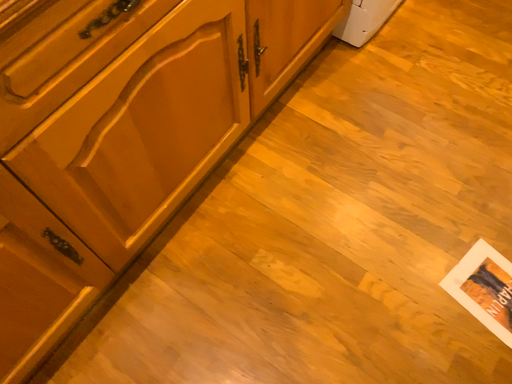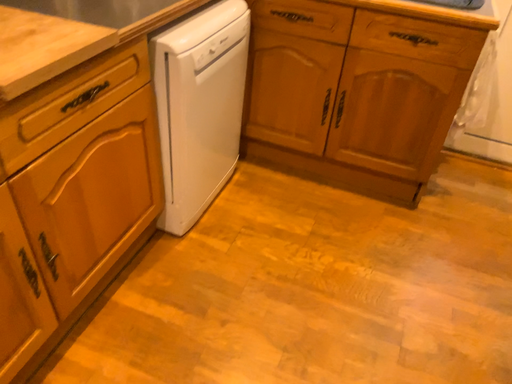
Question: Which way did the camera rotate in the video?

Choices:
 (A) rotated right
 (B) rotated left

Answer: (A)